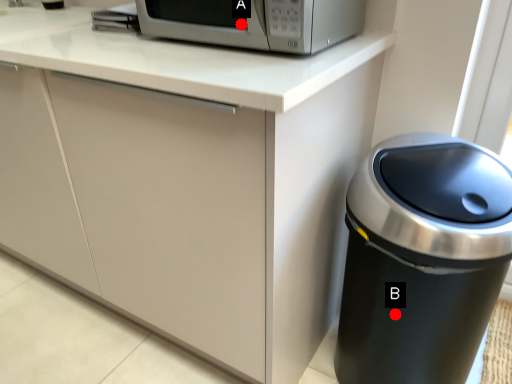
Question: Two points are circled on the image, labeled by A and B beside each circle. Which point is farther to the camera?

Choices:
 (A) A is further
 (B) B is further

Answer: (B)